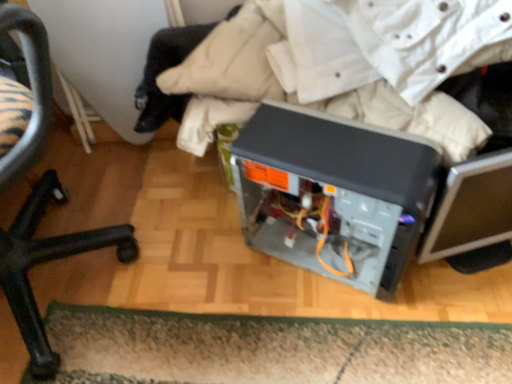
Question: Is green shaggy doormat at lower center situated inside satin black computer case at center or outside?

Choices:
 (A) outside
 (B) inside

Answer: (A)

Question: Based on their positions, is green shaggy doormat at lower center located to the left or right of satin black computer case at center?

Choices:
 (A) left
 (B) right

Answer: (A)

Question: Based on their relative distances, which object is nearer to the satin black computer case at center?

Choices:
 (A) green shaggy doormat at lower center
 (B) black plastic chair at lower left

Answer: (A)

Question: Estimate the real-world distances between objects in this image. Which object is closer to the green shaggy doormat at lower center?

Choices:
 (A) satin black computer case at center
 (B) black plastic chair at lower left

Answer: (A)